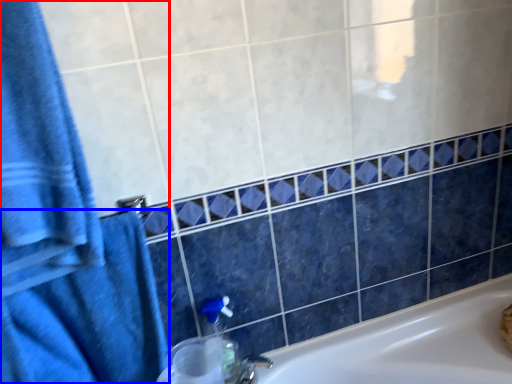
Question: Which object appears farthest to the camera in this image, bath towel (highlighted by a red box) or bath towel (highlighted by a blue box)?

Choices:
 (A) bath towel
 (B) bath towel

Answer: (B)